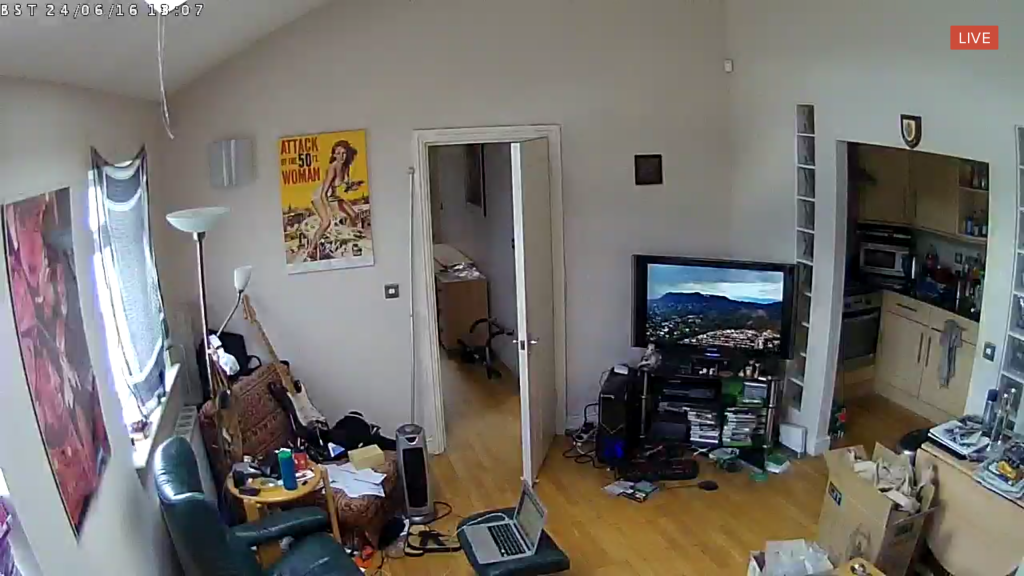
Where is `floor lamp`? floor lamp is located at coordinates (194, 221).